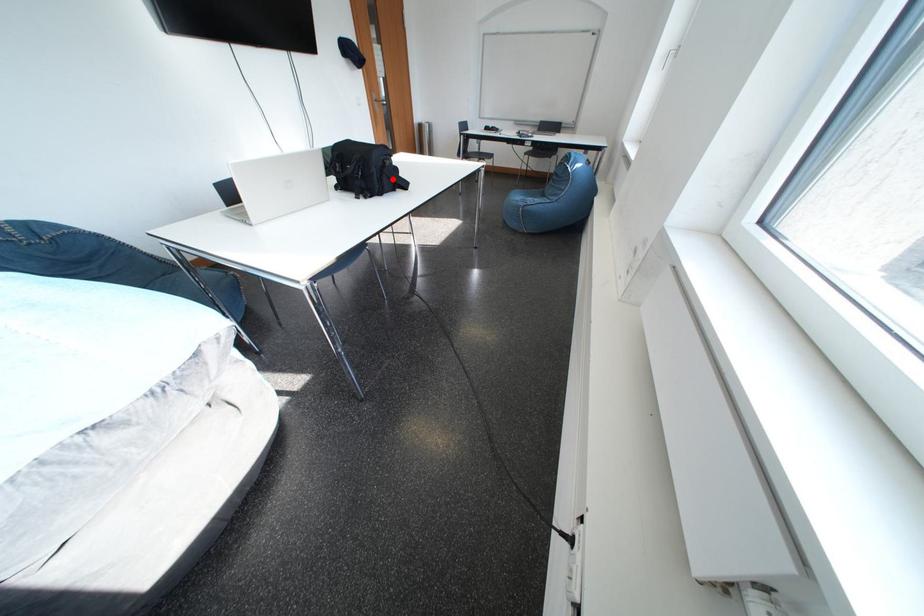
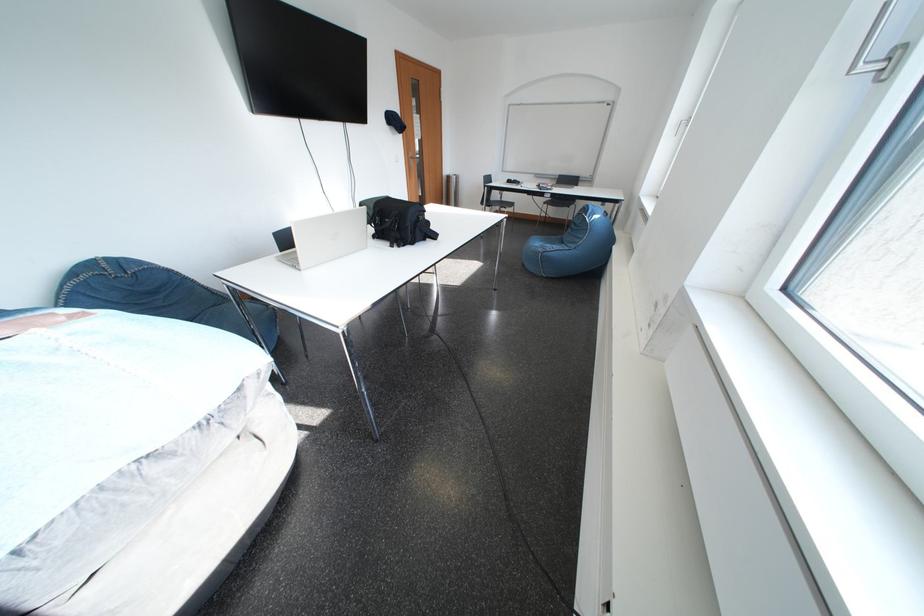
Locate, in the second image, the point that corresponds to the highlighted location in the first image.

(426, 232)